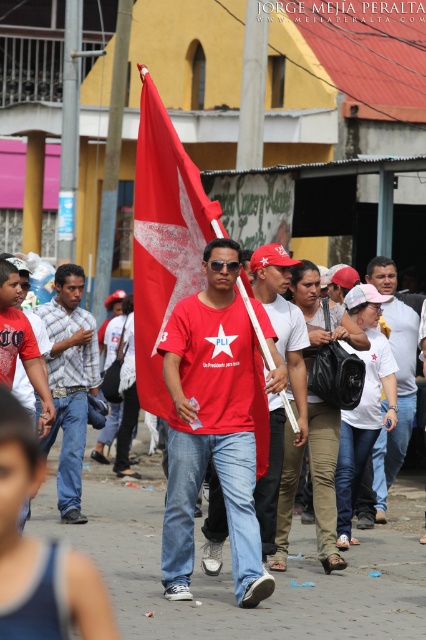
You are a photographer standing at the edge of the street. You want to take a photo that includes both the red fabric flag at center and the white matte shirt at center. What is the minimum distance you need to move backward to ensure both objects are in frame?

The red fabric flag at center and the white matte shirt at center are 4.09 meters apart. To include both in the photo, you need to move back until the camera can capture a field of view that spans at least 4.09 meters between them.